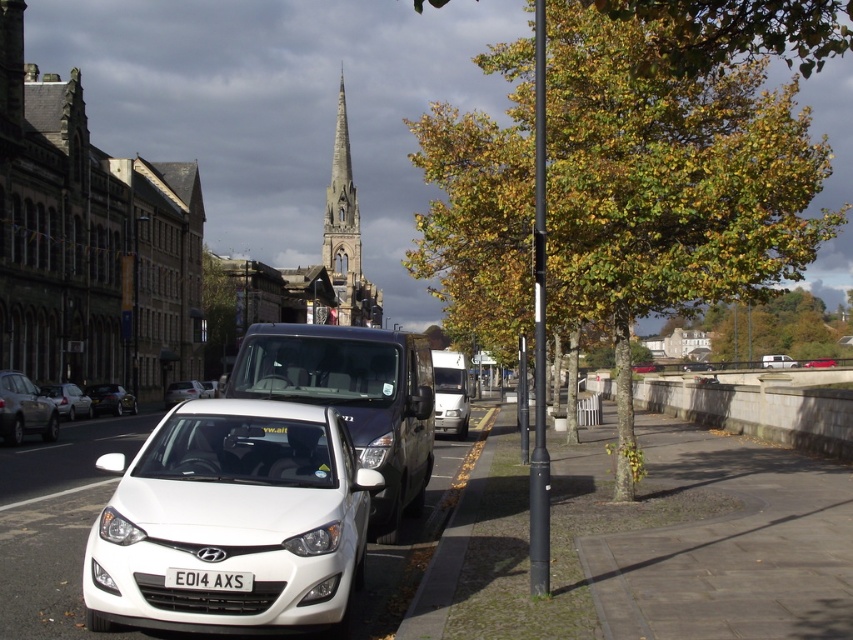
You are standing in the middle of the street in the European town scene. You want to take a photo of the church spire in the background without including the green leafy tree at upper right. Which direction should you move to avoid the tree?

Move to the left side of the street. Since the green leafy tree at upper right is located at point (770, 328), moving left would shift your perspective away from the tree, allowing you to frame the church spire without it.